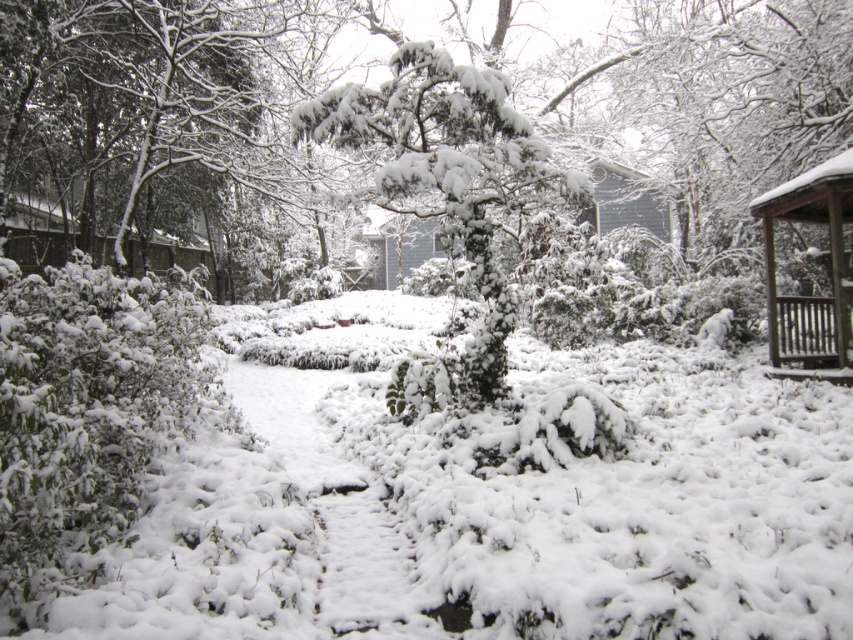
Question: Which of the following is the closest to the observer?

Choices:
 (A) (834, 220)
 (B) (497, 381)

Answer: (B)

Question: Among these points, which one is nearest to the camera?

Choices:
 (A) (514, 198)
 (B) (824, 192)

Answer: (A)

Question: Is snow-covered evergreen at center positioned before wooden gazebo at right?

Choices:
 (A) yes
 (B) no

Answer: (A)

Question: Is snow-covered evergreen at center wider than wooden gazebo at right?

Choices:
 (A) yes
 (B) no

Answer: (A)

Question: Does snow-covered evergreen at center have a smaller size compared to wooden gazebo at right?

Choices:
 (A) no
 (B) yes

Answer: (A)